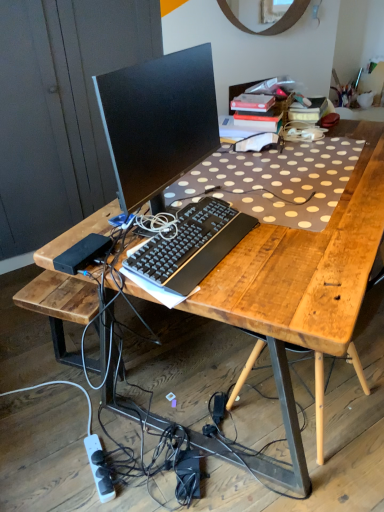
Question: From the image's perspective, relative to wooden desk at center, is white plastic power strip at lower left above or below?

Choices:
 (A) above
 (B) below

Answer: (B)

Question: Visually, is white plastic power strip at lower left positioned to the left or to the right of wooden desk at center?

Choices:
 (A) right
 (B) left

Answer: (B)

Question: Based on their relative distances, which object is farther from the wooden desk at center?

Choices:
 (A) matte black monitor at center
 (B) white plastic power strip at lower left
 (C) black plastic keyboard at center
 (D) wooden at right

Answer: (B)

Question: Estimate the real-world distances between objects in this image. Which object is farther from the black plastic keyboard at center?

Choices:
 (A) wooden at right
 (B) white plastic power strip at lower left
 (C) matte black monitor at center
 (D) wooden desk at center

Answer: (B)